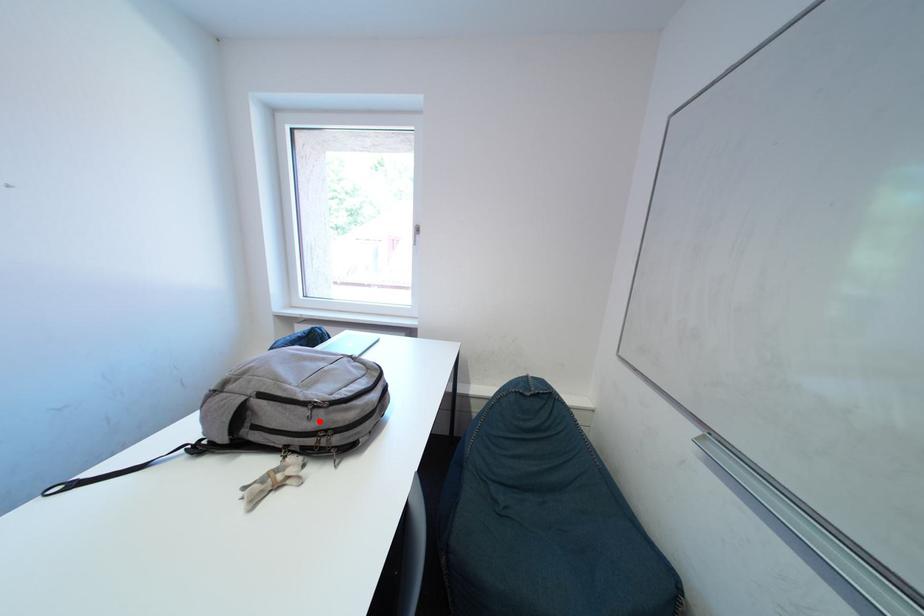
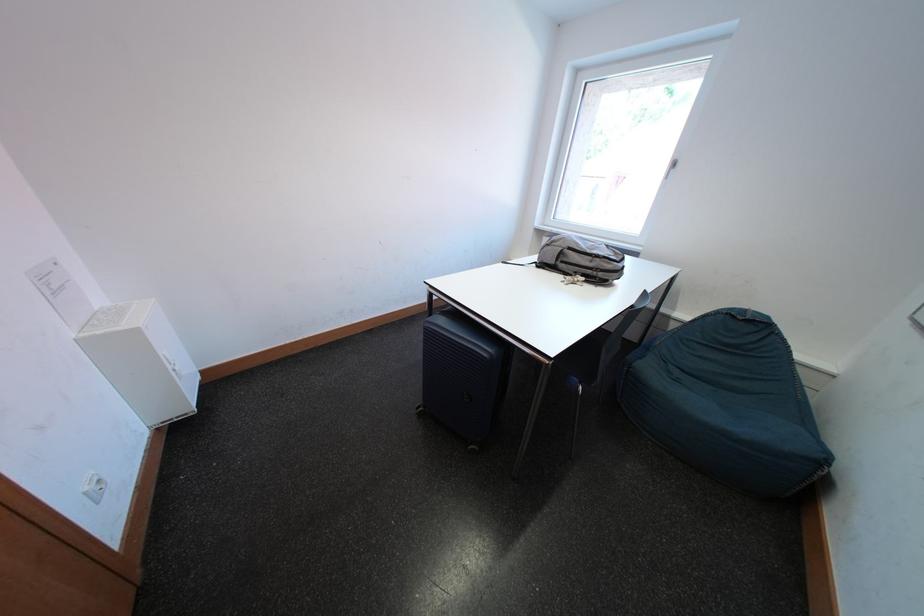
In the second image, find the point that corresponds to the highlighted location in the first image.

(601, 265)